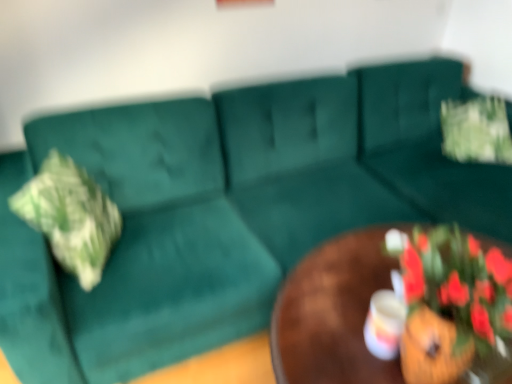
Question: Is matte white coffee cup at center oriented away from green textured pillow at left?

Choices:
 (A) no
 (B) yes

Answer: (A)

Question: From a real-world perspective, does matte white coffee cup at center sit lower than green textured pillow at left?

Choices:
 (A) yes
 (B) no

Answer: (B)

Question: Considering the relative sizes of matte white coffee cup at center and green textured pillow at left in the image provided, is matte white coffee cup at center smaller than green textured pillow at left?

Choices:
 (A) no
 (B) yes

Answer: (B)

Question: From the image's perspective, is matte white coffee cup at center located beneath green textured pillow at left?

Choices:
 (A) no
 (B) yes

Answer: (B)

Question: Is matte white coffee cup at center beside green textured pillow at left?

Choices:
 (A) no
 (B) yes

Answer: (A)

Question: Is point (446, 100) closer or farther from the camera than point (362, 354)?

Choices:
 (A) farther
 (B) closer

Answer: (A)

Question: Relative to brown wooden table at center, is green fabric flower at upper right in front or behind?

Choices:
 (A) behind
 (B) front

Answer: (A)

Question: Is green fabric flower at upper right situated inside brown wooden table at center or outside?

Choices:
 (A) inside
 (B) outside

Answer: (B)

Question: From the image's perspective, is green fabric flower at upper right positioned above or below brown wooden table at center?

Choices:
 (A) above
 (B) below

Answer: (A)

Question: Does point (320, 304) appear closer or farther from the camera than point (379, 294)?

Choices:
 (A) closer
 (B) farther

Answer: (B)

Question: From the image's perspective, is brown wooden table at center above or below matte white coffee cup at center?

Choices:
 (A) below
 (B) above

Answer: (A)

Question: Looking at their shapes, would you say brown wooden table at center is wider or thinner than matte white coffee cup at center?

Choices:
 (A) thin
 (B) wide

Answer: (B)

Question: In the image, is brown wooden table at center positioned in front of or behind matte white coffee cup at center?

Choices:
 (A) behind
 (B) front

Answer: (B)

Question: Which is correct: green textured pillow at left is inside green fabric flower at upper right, or outside of it?

Choices:
 (A) outside
 (B) inside

Answer: (A)

Question: From the image's perspective, is green textured pillow at left located above or below green fabric flower at upper right?

Choices:
 (A) below
 (B) above

Answer: (A)